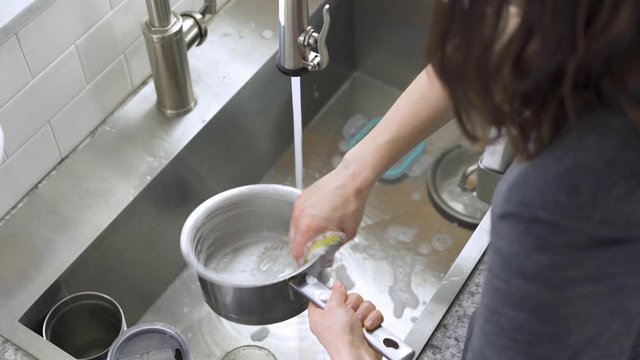
This screenshot has height=360, width=640. In order to click on the bottom of the faucet showing in this screenshot , I will do [176, 85].